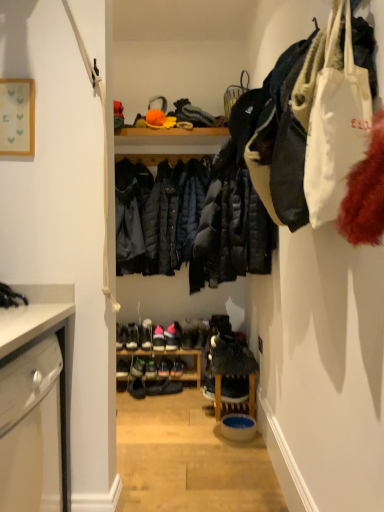
Question: Considering the relative positions of shiny black shoe at center, which appears as the fourth footwear when viewed from the right, and shiny black shoe at center, acting as the 2th footwear starting from the right, in the image provided, is shiny black shoe at center, which appears as the fourth footwear when viewed from the right, in front of shiny black shoe at center, acting as the 2th footwear starting from the right,?

Choices:
 (A) yes
 (B) no

Answer: (A)

Question: Is shiny black shoe at center, which appears as the fourth footwear when viewed from the right, not within shiny black shoe at center, the 7th footwear when ordered from left to right?

Choices:
 (A) no
 (B) yes

Answer: (B)

Question: Can you confirm if shiny black shoe at center, the 5th footwear positioned from the left, is thinner than shiny black shoe at center, acting as the 2th footwear starting from the right?

Choices:
 (A) yes
 (B) no

Answer: (A)

Question: Considering the relative sizes of shiny black shoe at center, the 5th footwear positioned from the left, and shiny black shoe at center, the 7th footwear when ordered from left to right, in the image provided, is shiny black shoe at center, the 5th footwear positioned from the left, wider than shiny black shoe at center, the 7th footwear when ordered from left to right,?

Choices:
 (A) yes
 (B) no

Answer: (B)

Question: From the image's perspective, would you say shiny black shoe at center, the 5th footwear positioned from the left, is shown under shiny black shoe at center, the 7th footwear when ordered from left to right?

Choices:
 (A) no
 (B) yes

Answer: (B)

Question: Considering the positions of matte black shoe at center, which is the 6th footwear in right-to-left order, and shiny black shoe at center, acting as the 2th footwear starting from the right, in the image, is matte black shoe at center, which is the 6th footwear in right-to-left order, taller or shorter than shiny black shoe at center, acting as the 2th footwear starting from the right,?

Choices:
 (A) short
 (B) tall

Answer: (A)

Question: Based on their sizes in the image, would you say matte black shoe at center, which is the 6th footwear in right-to-left order, is bigger or smaller than shiny black shoe at center, acting as the 2th footwear starting from the right?

Choices:
 (A) big
 (B) small

Answer: (B)

Question: From the image's perspective, is matte black shoe at center, which ranks as the 3th footwear in left-to-right order, positioned above or below shiny black shoe at center, the 7th footwear when ordered from left to right?

Choices:
 (A) above
 (B) below

Answer: (A)

Question: Choose the correct answer: Is matte black shoe at center, which ranks as the 3th footwear in left-to-right order, inside shiny black shoe at center, the 7th footwear when ordered from left to right, or outside it?

Choices:
 (A) inside
 (B) outside

Answer: (B)

Question: Considering the positions of point (153, 349) and point (170, 324), is point (153, 349) closer or farther from the camera than point (170, 324)?

Choices:
 (A) farther
 (B) closer

Answer: (B)

Question: Looking at the image, does matte black shoe at center, which is the 6th footwear in right-to-left order, seem bigger or smaller compared to shiny black sneakers at center, the 3th footwear positioned from the right?

Choices:
 (A) small
 (B) big

Answer: (A)

Question: In the image, is matte black shoe at center, which is the 6th footwear in right-to-left order, on the left side or the right side of shiny black sneakers at center, the sixth footwear positioned from the left?

Choices:
 (A) right
 (B) left

Answer: (B)

Question: In the image, is matte black shoe at center, which is the 6th footwear in right-to-left order, positioned in front of or behind shiny black sneakers at center, the 3th footwear positioned from the right?

Choices:
 (A) front
 (B) behind

Answer: (A)

Question: Which is correct: matte black shoe at center, which is the 6th footwear in right-to-left order, is inside black leather shoes at center, acting as the fourth footwear starting from the left, or outside of it?

Choices:
 (A) inside
 (B) outside

Answer: (B)

Question: Looking at the image, does matte black shoe at center, which ranks as the 3th footwear in left-to-right order, seem bigger or smaller compared to black leather shoes at center, the fifth footwear in the right-to-left sequence?

Choices:
 (A) small
 (B) big

Answer: (A)